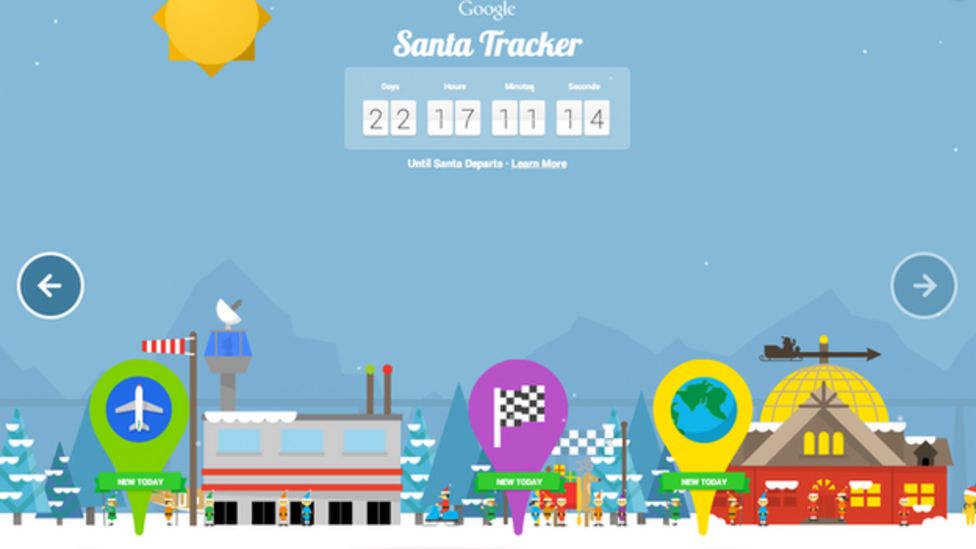
What are the coordinates of `chimney` in the screenshot? It's located at (369, 389), (384, 389).